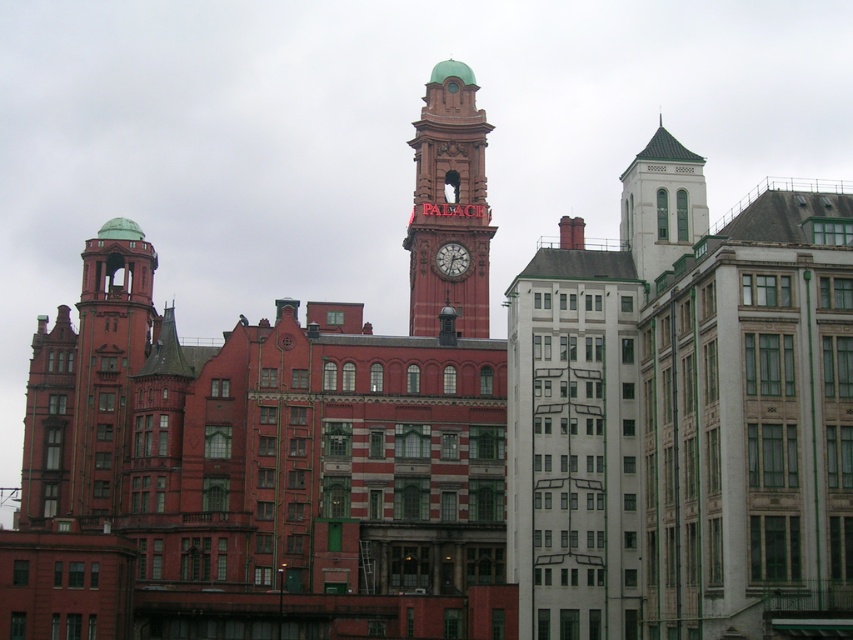
Consider the image. Between white smooth building at center-right and white glass tower at upper right, which one is positioned lower?

white smooth building at center-right

Who is higher up, white smooth building at center-right or white glass tower at upper right?

Positioned higher is white glass tower at upper right.

Is point (526, 442) in front of point (672, 161)?

Yes, it is.

This screenshot has height=640, width=853. I want to click on white smooth building at center-right, so click(573, 440).

Who is positioned more to the right, matte red tower at left or matte red clock at center?

From the viewer's perspective, matte red clock at center appears more on the right side.

Who is more distant from viewer, [77,497] or [450,250]?

Positioned behind is point [450,250].

Does point (125, 220) come behind point (442, 257)?

No, it is not.

Image resolution: width=853 pixels, height=640 pixels. Identify the location of matte red tower at left. (108, 362).

Between matte red clock tower at center and white glass tower at upper right, which one is positioned lower?

matte red clock tower at center

Is point (450, 252) positioned after point (665, 164)?

Yes.

Find the location of a particular element. The width and height of the screenshot is (853, 640). matte red clock tower at center is located at coordinates (450, 205).

This screenshot has height=640, width=853. In order to click on matte red clock tower at center in this screenshot , I will do `click(450, 205)`.